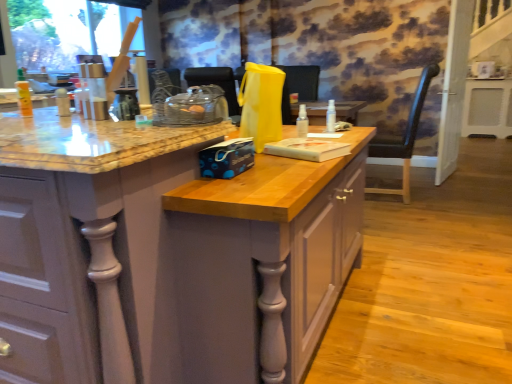
This screenshot has width=512, height=384. I want to click on vacant area located to the right-hand side of white glossy screen door at right, so click(482, 175).